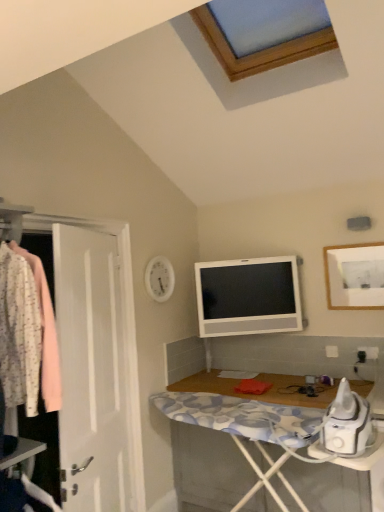
I want to click on free space above white wood desk at lower right (from a real-world perspective), so coord(278,380).